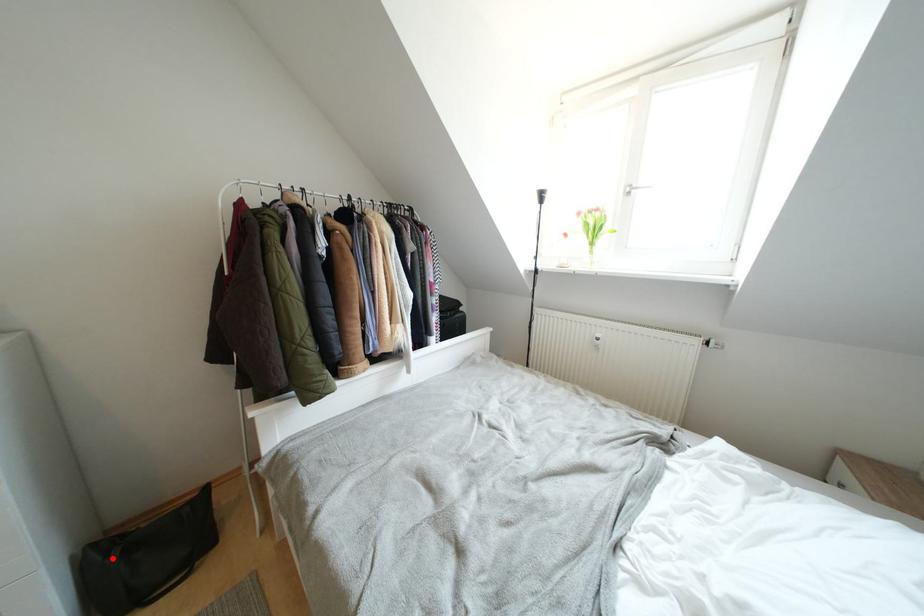
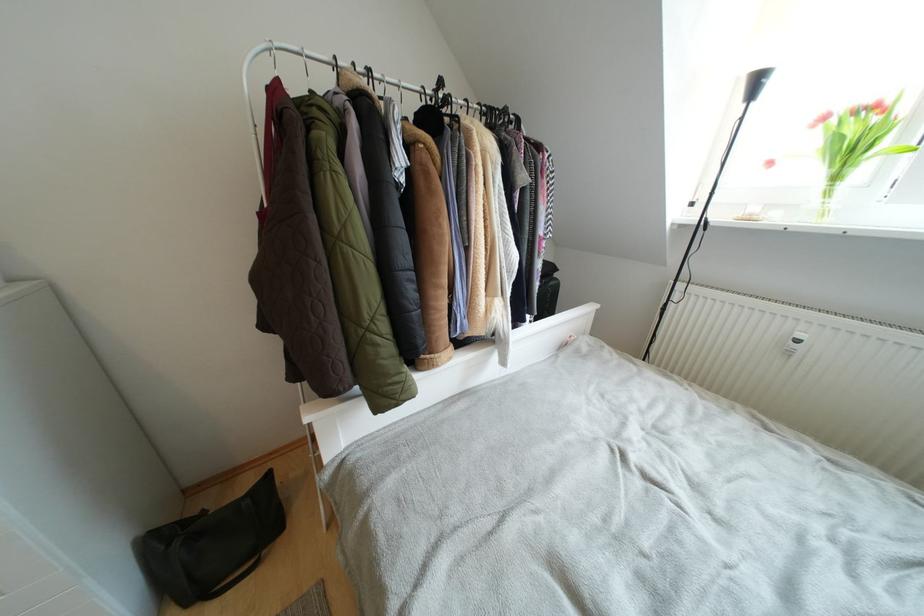
Where in the second image is the point corresponding to the highlighted location from the first image?

(175, 549)